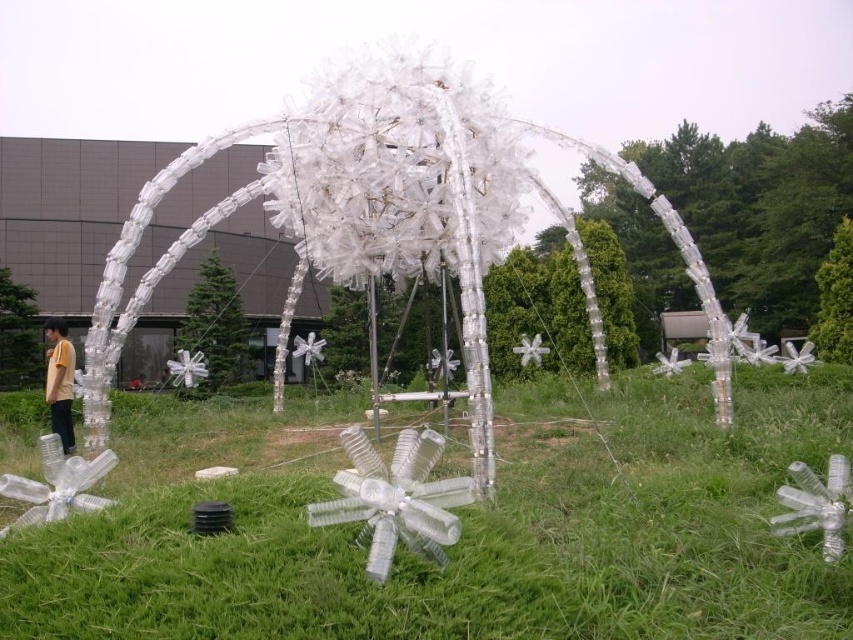
Can you confirm if transparent plastic flower at center is taller than yellow matte shirt at lower left?

No.

Who is more distant from viewer, (520, 611) or (68, 442)?

Point (68, 442)

Identify the location of transparent plastic flower at center. (483, 540).

Between transparent plastic flower at center and transparent plastic sculpture at center, which one is positioned lower?

transparent plastic flower at center is below.

Can you confirm if transparent plastic flower at center is taller than transparent plastic sculpture at center?

In fact, transparent plastic flower at center may be shorter than transparent plastic sculpture at center.

Which is in front, point (619, 608) or point (412, 250)?

Positioned in front is point (619, 608).

You are a GUI agent. You are given a task and a screenshot of the screen. Output one action in this format:
    pyautogui.click(x=<x>, y=<y>)
    Task: Click on the transparent plastic flower at center
    
    Given the screenshot: What is the action you would take?
    point(483,540)

Who is shorter, transparent plastic sculpture at center or yellow matte shirt at lower left?

Result: With less height is transparent plastic sculpture at center.

The image size is (853, 640). I want to click on transparent plastic sculpture at center, so click(x=392, y=211).

Where is `transparent plastic sculpture at center`? The width and height of the screenshot is (853, 640). transparent plastic sculpture at center is located at coordinates (392, 211).